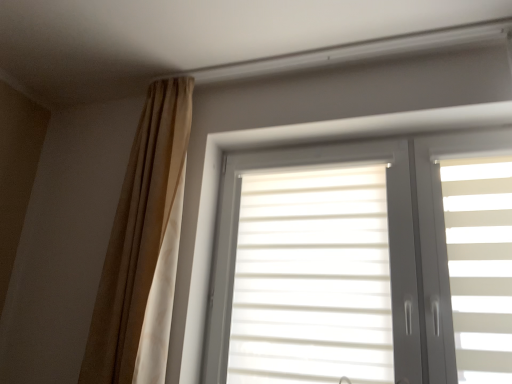
Question: From a real-world perspective, relative to white matte window at center, is beige fabric curtain at upper left vertically above or below?

Choices:
 (A) below
 (B) above

Answer: (B)

Question: Is beige fabric curtain at upper left taller or shorter than white matte window at center?

Choices:
 (A) tall
 (B) short

Answer: (A)

Question: Is beige fabric curtain at upper left inside or outside of white matte window at center?

Choices:
 (A) outside
 (B) inside

Answer: (A)

Question: Is white matte window at center to the left or to the right of beige fabric curtain at upper left in the image?

Choices:
 (A) right
 (B) left

Answer: (A)

Question: From a real-world perspective, is white matte window at center positioned above or below beige fabric curtain at upper left?

Choices:
 (A) above
 (B) below

Answer: (B)

Question: Is white matte window at center bigger or smaller than beige fabric curtain at upper left?

Choices:
 (A) small
 (B) big

Answer: (B)

Question: In the image, is white matte window at center positioned in front of or behind beige fabric curtain at upper left?

Choices:
 (A) front
 (B) behind

Answer: (A)